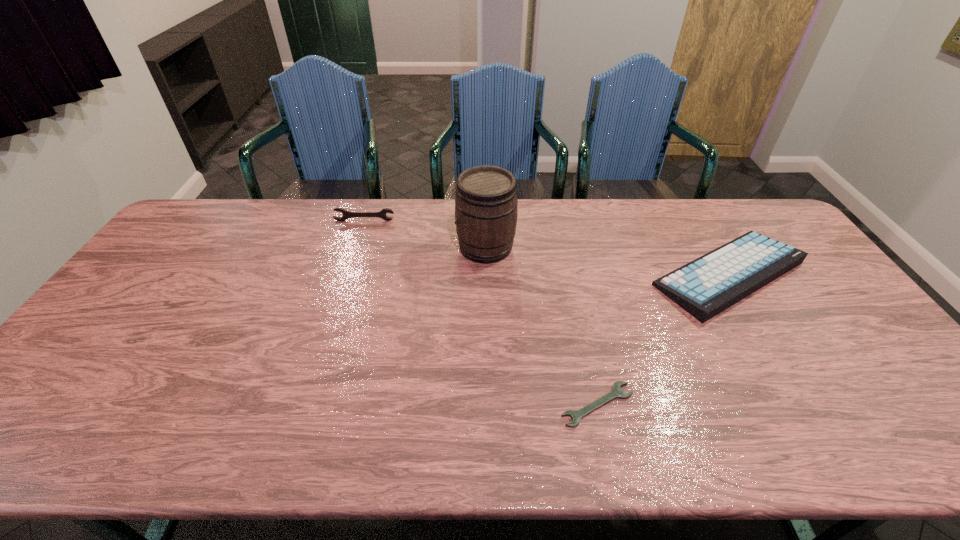
Identify the location of free spot at the far left corner of the desktop. (184, 237).

Find the location of a particular element. This screenshot has width=960, height=540. free space at the near left corner of the desktop is located at coordinates (46, 426).

Locate an element on the screen. The height and width of the screenshot is (540, 960). unoccupied area between the tallest object and the taller wrench is located at coordinates (425, 234).

Locate an element on the screen. The image size is (960, 540). vacant space in between the leftmost object and the right wrench is located at coordinates (481, 313).

Identify the location of empty space that is in between the right wrench and the rightmost object. (663, 339).

Identify the location of free space between the right wrench and the tallest object. (541, 326).

Find the location of a particular element. This screenshot has width=960, height=540. free space between the left wrench and the second object from left to right is located at coordinates coord(425,234).

In order to click on blank region between the shortest object and the farthest object in this screenshot , I will do `click(481, 313)`.

Locate an element on the screen. This screenshot has width=960, height=540. blank region between the computer keyboard and the nearer wrench is located at coordinates (663, 339).

Where is `vacant area that lies between the farthest object and the right wrench`? vacant area that lies between the farthest object and the right wrench is located at coordinates (481, 313).